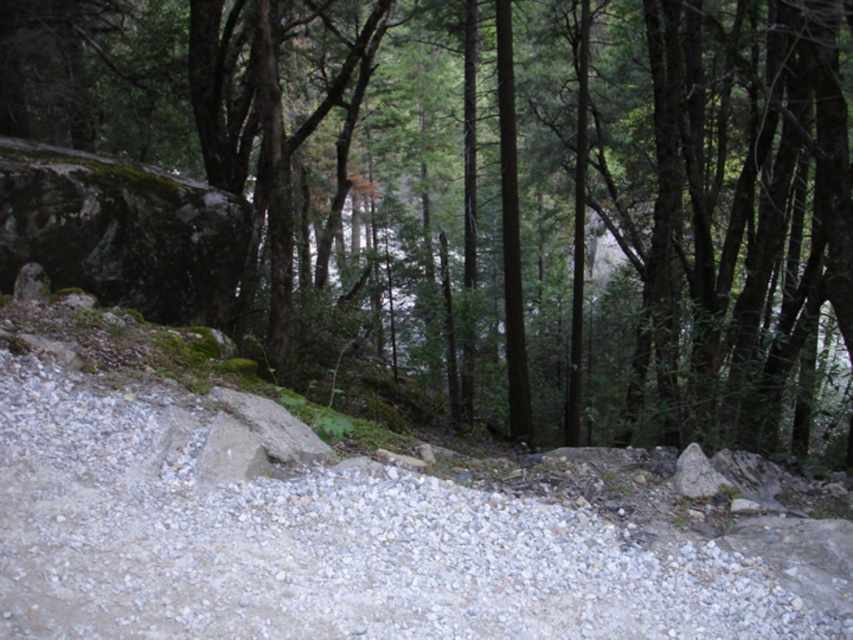
Question: Is green leafy tree at center bigger than gray gravel path at center?

Choices:
 (A) no
 (B) yes

Answer: (B)

Question: Can you confirm if green leafy tree at center is wider than gray gravel path at center?

Choices:
 (A) no
 (B) yes

Answer: (B)

Question: Which point appears farthest from the camera in this image?

Choices:
 (A) (550, 96)
 (B) (136, 616)

Answer: (A)

Question: Which of the following is the farthest from the observer?

Choices:
 (A) (469, 145)
 (B) (129, 561)

Answer: (A)

Question: Is green leafy tree at center above gray gravel path at center?

Choices:
 (A) no
 (B) yes

Answer: (B)